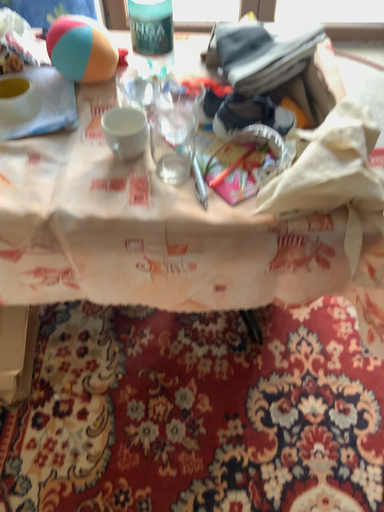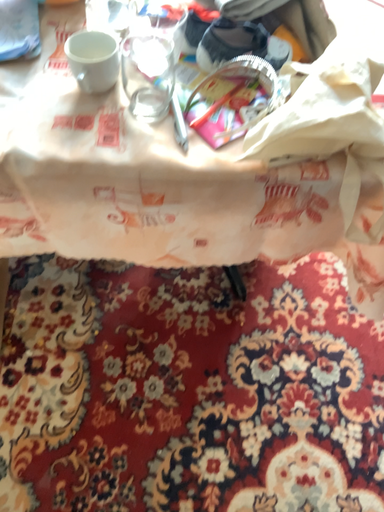
Question: How did the camera likely rotate when shooting the video?

Choices:
 (A) rotated upward
 (B) rotated downward

Answer: (B)